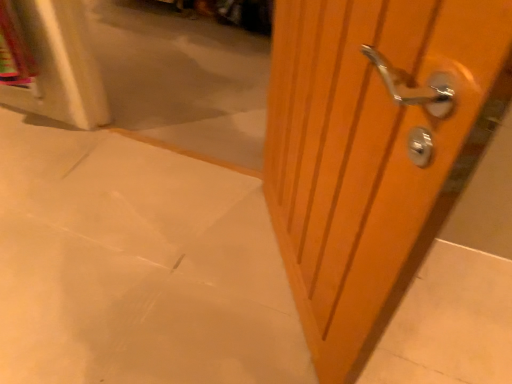
Image resolution: width=512 pixels, height=384 pixels. Describe the element at coordinates (374, 150) in the screenshot. I see `wooden door handle at right` at that location.

At what (x,y) coordinates should I click in order to perform the action: click on wooden door handle at right. Please return your answer as a coordinate pair (x, y). Image resolution: width=512 pixels, height=384 pixels. Looking at the image, I should click on (374, 150).

This screenshot has height=384, width=512. What do you see at coordinates (136, 266) in the screenshot?
I see `matte white concrete at center` at bounding box center [136, 266].

I want to click on matte white concrete at center, so click(x=136, y=266).

The image size is (512, 384). I want to click on wooden door handle at right, so click(374, 150).

Is matte white concrete at center to the left of wooden door handle at right from the viewer's perspective?

Correct, you'll find matte white concrete at center to the left of wooden door handle at right.

Based on the photo, considering the positions of objects matte white concrete at center and wooden door handle at right in the image provided, who is behind, matte white concrete at center or wooden door handle at right?

matte white concrete at center.

Is point (86, 335) more distant than point (336, 230)?

Yes, it is behind point (336, 230).

In the scene shown: From the image's perspective, which is below, matte white concrete at center or wooden door handle at right?

From the image's view, matte white concrete at center is below.

From a real-world perspective, relative to wooden door handle at right, is matte white concrete at center vertically above or below?

From a real-world perspective, matte white concrete at center is physically below wooden door handle at right.

Between matte white concrete at center and wooden door handle at right, which one has larger width?

matte white concrete at center is wider.

Considering the relative sizes of matte white concrete at center and wooden door handle at right in the image provided, is matte white concrete at center taller than wooden door handle at right?

No, matte white concrete at center is not taller than wooden door handle at right.

Considering the relative sizes of matte white concrete at center and wooden door handle at right in the image provided, is matte white concrete at center bigger than wooden door handle at right?

No.

Can wooden door handle at right be found inside matte white concrete at center?

No, wooden door handle at right is not inside matte white concrete at center.

Is the surface of matte white concrete at center in direct contact with wooden door handle at right?

No.

Does matte white concrete at center turn towards wooden door handle at right?

No, matte white concrete at center is not oriented towards wooden door handle at right.

Measure the distance between matte white concrete at center and wooden door handle at right.

A distance of 22.68 inches exists between matte white concrete at center and wooden door handle at right.

What are the coordinates of `door that appears above the matte white concrete at center (from the image's perspective)` in the screenshot? It's located at (374, 150).

Is wooden door handle at right at the left side of matte white concrete at center?

Incorrect, wooden door handle at right is not on the left side of matte white concrete at center.

Is wooden door handle at right positioned before matte white concrete at center?

Yes.

Which is in front, point (501, 69) or point (239, 213)?

The point (501, 69) is closer.

Based on the photo, from the image's perspective, is wooden door handle at right above or below matte white concrete at center?

wooden door handle at right is above matte white concrete at center.

From a real-world perspective, which is physically above, wooden door handle at right or matte white concrete at center?

From a 3D spatial view, wooden door handle at right is above.

Between wooden door handle at right and matte white concrete at center, which one has smaller width?

Thinner between the two is wooden door handle at right.

Can you confirm if wooden door handle at right is taller than matte white concrete at center?

Yes, wooden door handle at right is taller than matte white concrete at center.

Which of these two, wooden door handle at right or matte white concrete at center, is smaller?

matte white concrete at center is smaller.

Is matte white concrete at center located within wooden door handle at right?

Definitely not — matte white concrete at center is not inside wooden door handle at right.

Is the surface of wooden door handle at right in direct contact with matte white concrete at center?

No.

Is wooden door handle at right facing away from matte white concrete at center?

Answer: No, wooden door handle at right is not facing away from matte white concrete at center.

From the picture: How different are the orientations of wooden door handle at right and matte white concrete at center in degrees?

124 degrees.

Identify the location of door located on the right of matte white concrete at center. (374, 150).

Locate an element on the screen. door in front of the matte white concrete at center is located at coordinates (374, 150).

Where is `concrete behind the wooden door handle at right`? This screenshot has width=512, height=384. concrete behind the wooden door handle at right is located at coordinates (136, 266).